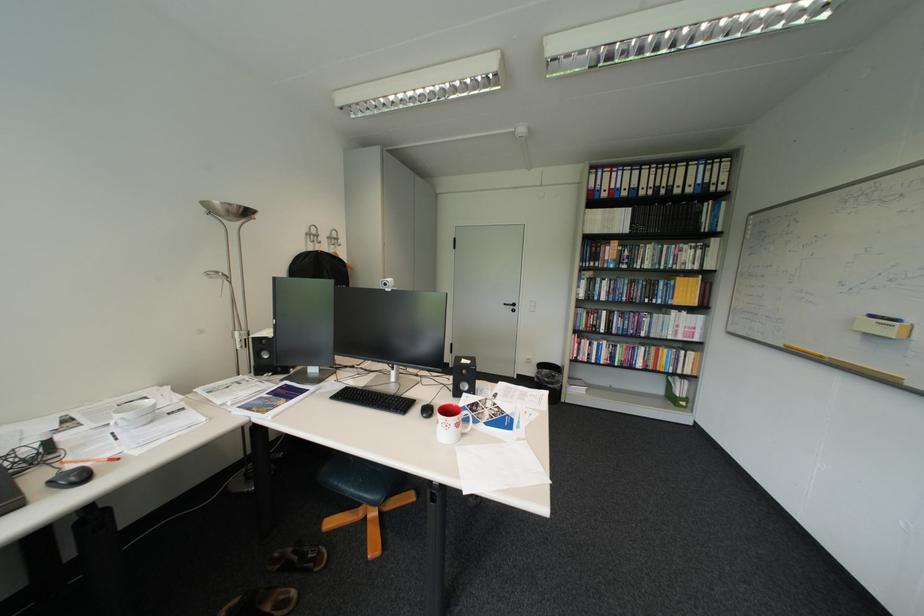
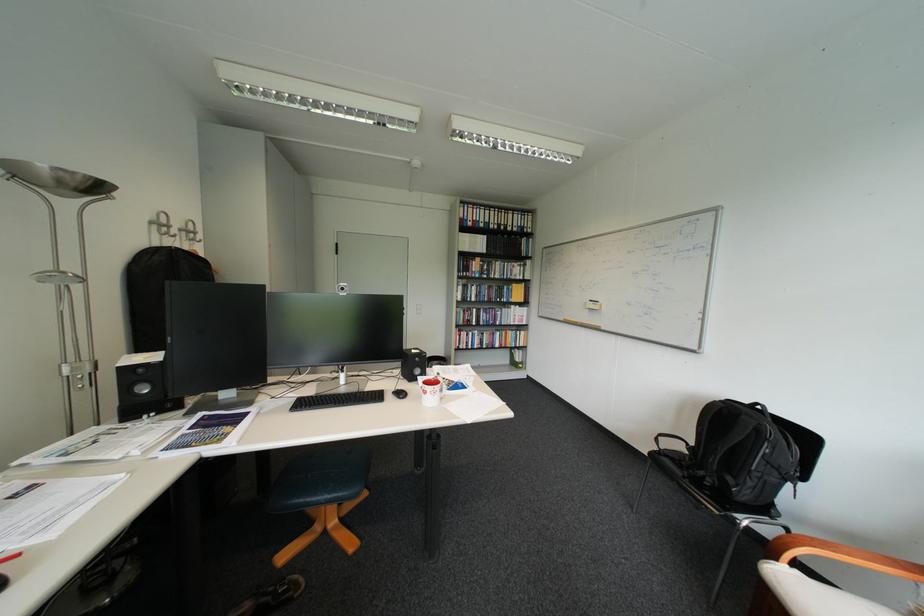
In the second image, find the point that corresponds to (x=655, y=188) in the first image.

(504, 224)